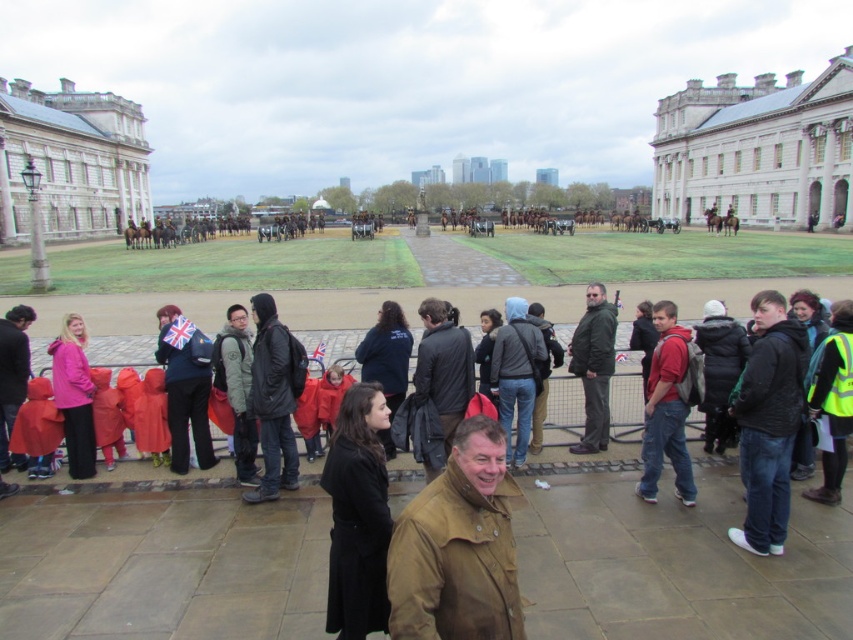
Who is positioned more to the left, matte red jacket at center or dark gray jacket at center?

dark gray jacket at center

Measure the distance between matte red jacket at center and dark gray jacket at center.

matte red jacket at center and dark gray jacket at center are 43.86 feet apart from each other.

Does point (647, 426) come closer to viewer compared to point (450, 348)?

Yes, it is.

Locate an element on the screen. matte red jacket at center is located at coordinates (666, 410).

Is brown leather jacket at center bigger than dark gray jacket at center?

Indeed, brown leather jacket at center has a larger size compared to dark gray jacket at center.

Is brown leather jacket at center below dark gray jacket at center?

Yes.

Is point (473, 628) more distant than point (437, 326)?

That is False.

Where is `brown leather jacket at center`? The width and height of the screenshot is (853, 640). brown leather jacket at center is located at coordinates (457, 547).

Is white glossy building at upper left positioned before dark gray jacket at center?

That is False.

Is white glossy building at upper left further to camera compared to dark gray jacket at center?

Yes, white glossy building at upper left is further from the viewer.

The width and height of the screenshot is (853, 640). I want to click on white glossy building at upper left, so click(x=71, y=161).

This screenshot has width=853, height=640. In order to click on white glossy building at upper left in this screenshot , I will do `click(71, 161)`.